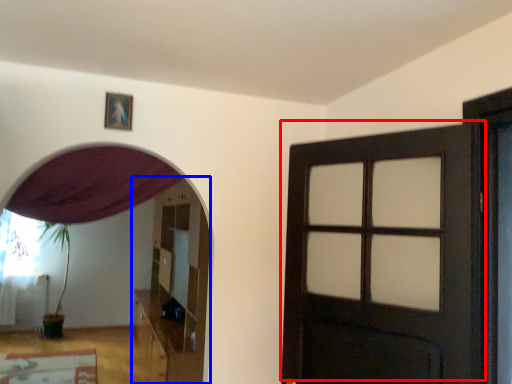
Question: Which object appears farthest to the camera in this image, door (highlighted by a red box) or dresser (highlighted by a blue box)?

Choices:
 (A) door
 (B) dresser

Answer: (B)